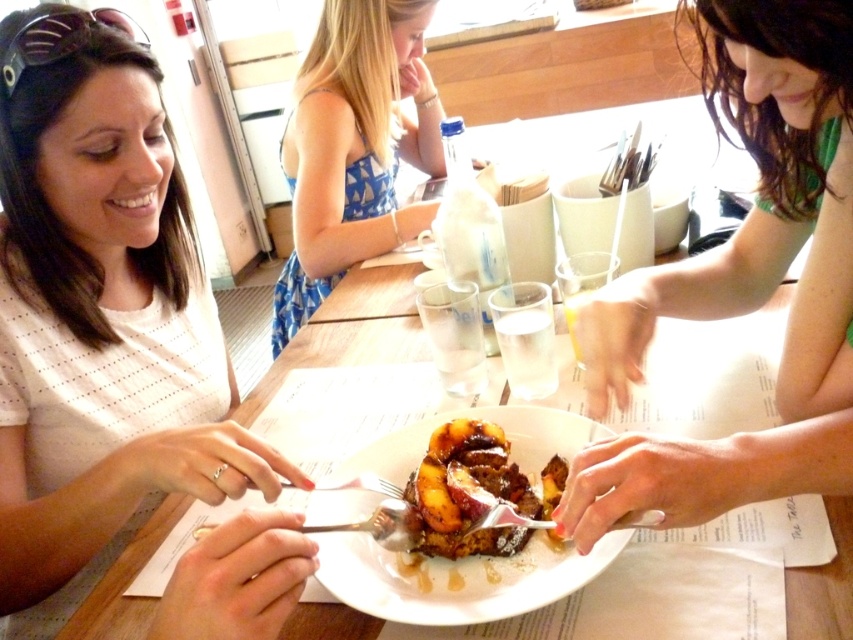
Which of these two, matte green shirt at right or crispy golden-brown bread pudding with caramelized peaches at center, stands shorter?

Standing shorter between the two is crispy golden-brown bread pudding with caramelized peaches at center.

How distant is matte green shirt at right from crispy golden-brown bread pudding with caramelized peaches at center?

They are 21.40 centimeters apart.

Does point (695, 292) come farther from viewer compared to point (541, 472)?

Yes, it is behind point (541, 472).

Identify the location of matte green shirt at right. This screenshot has width=853, height=640. (743, 285).

Is point (117, 150) positioned behind point (433, 492)?

Yes, point (117, 150) is behind point (433, 492).

Between white dotted shirt at left and crispy golden-brown bread pudding with caramelized peaches at center, which one is positioned lower?

crispy golden-brown bread pudding with caramelized peaches at center

Does point (134, 29) come in front of point (480, 540)?

No, it is not.

Locate an element on the screen. white dotted shirt at left is located at coordinates (100, 305).

Is white dotted shirt at left positioned behind golden brown syrup-soaked bread at center?

No, white dotted shirt at left is closer to the viewer.

Is white dotted shirt at left shorter than golden brown syrup-soaked bread at center?

No, white dotted shirt at left is not shorter than golden brown syrup-soaked bread at center.

Who is more distant from viewer, [74,20] or [352,516]?

Point [74,20]

Locate an element on the screen. white dotted shirt at left is located at coordinates (100, 305).